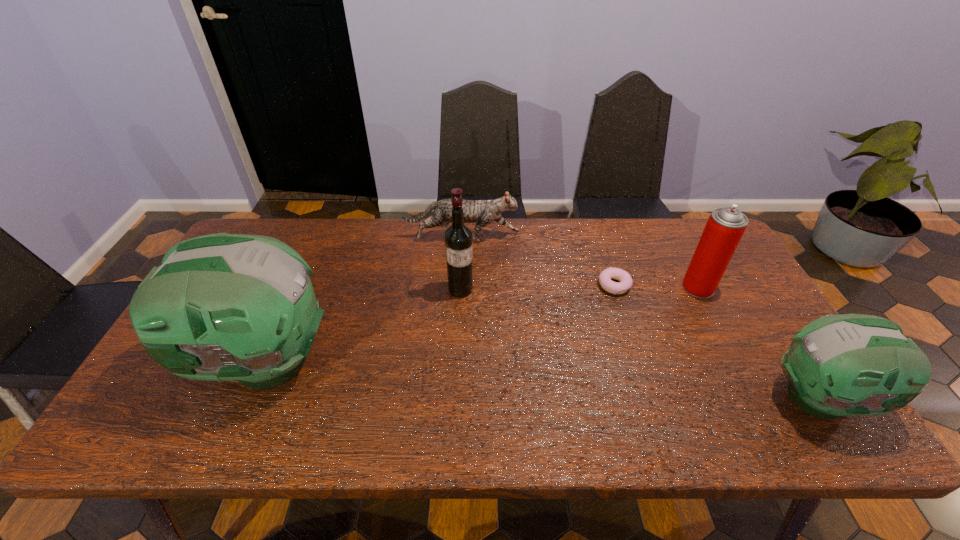
This screenshot has width=960, height=540. Identify the location of location for an additional football_helmet to make spacing equal. (532, 379).